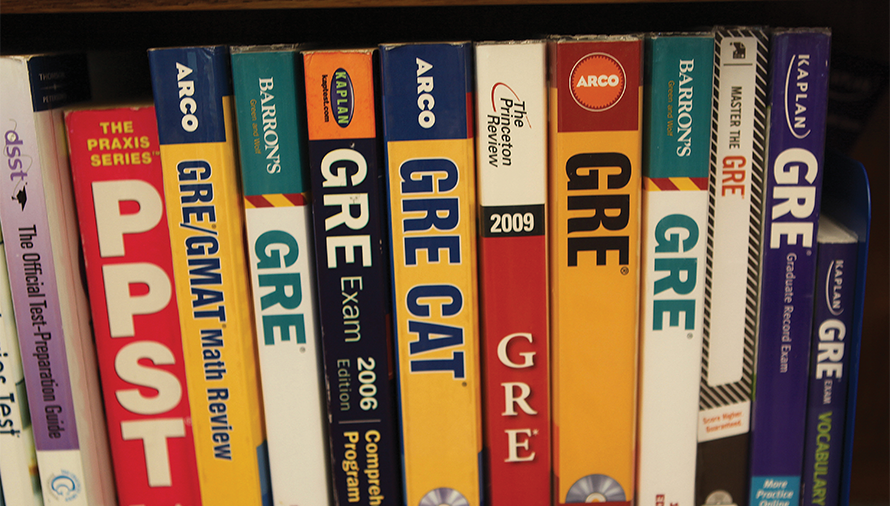
I want to click on yellow books, so click(x=236, y=478), click(x=441, y=394), click(x=609, y=350).